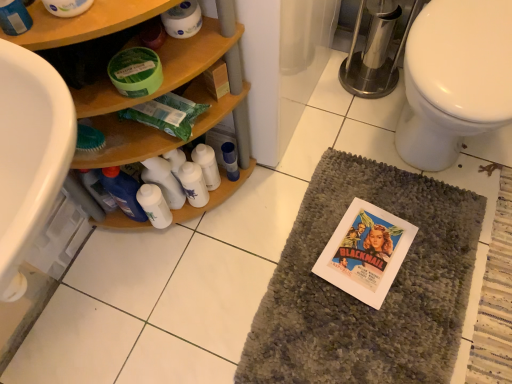
Find the location of a particular element. empty space that is in between white plastic bottles at center, positioned as the 1th bottle in left-to-right order, and gray textured bath mat at center is located at coordinates [x=256, y=233].